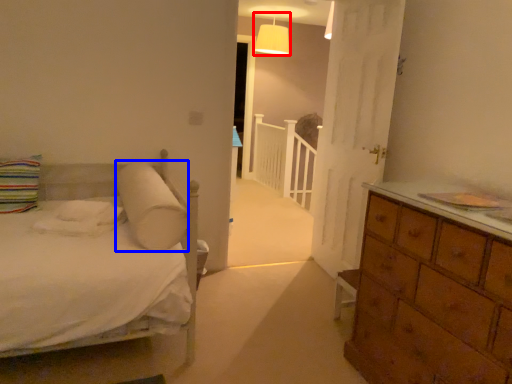
Question: Which object is further to the camera taking this photo, lamp (highlighted by a red box) or pillow (highlighted by a blue box)?

Choices:
 (A) lamp
 (B) pillow

Answer: (A)